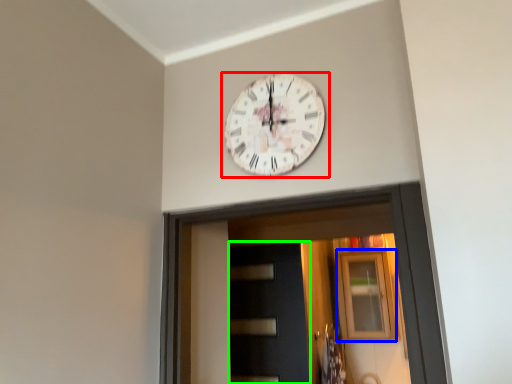
Question: Estimate the real-world distances between objects in this image. Which object is farther from wall clock (highlighted by a red box), window (highlighted by a blue box) or door (highlighted by a green box)?

Choices:
 (A) window
 (B) door

Answer: (A)